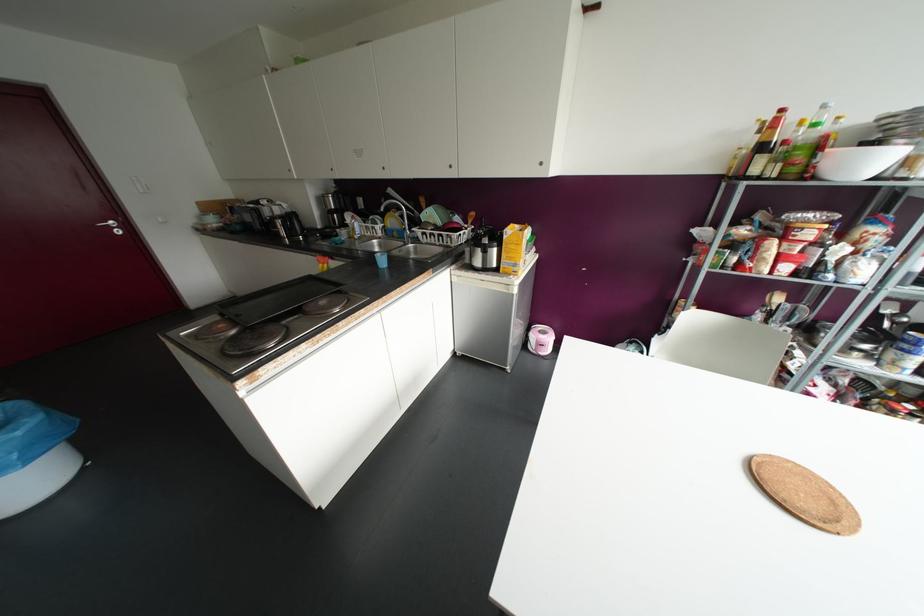
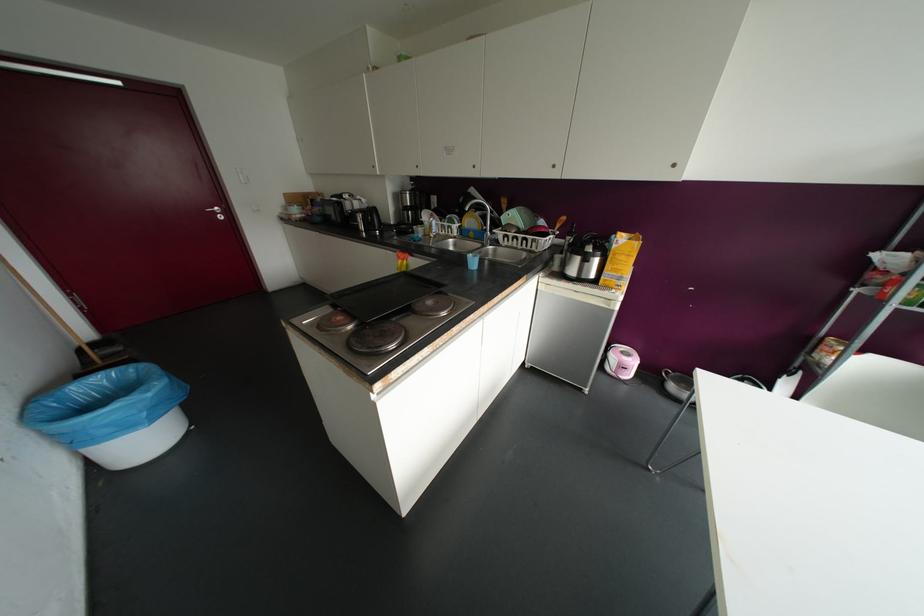
Locate, in the second image, the point that corresponds to [338,284] in the first image.

(441, 284)